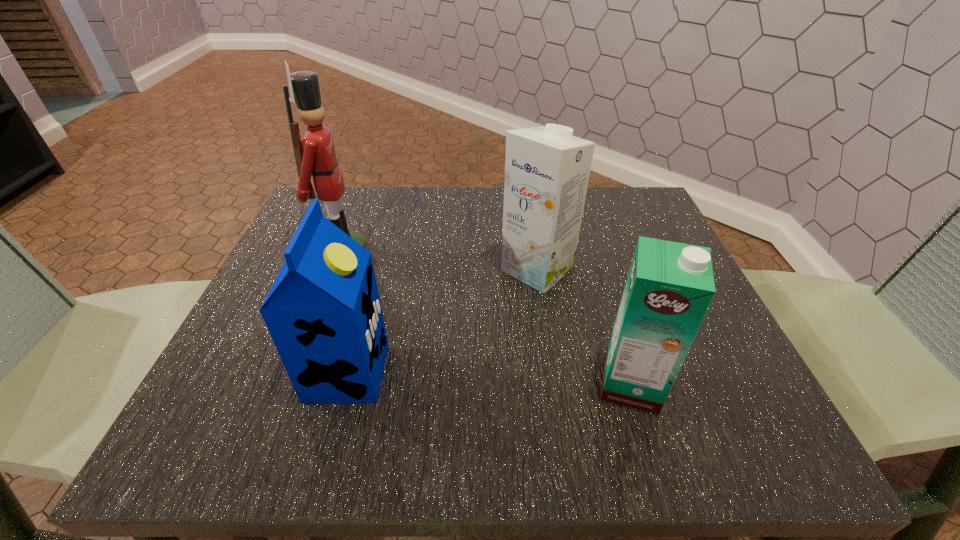
Identify the location of the tallest object. (315, 156).

Locate an element on the screen. This screenshot has width=960, height=540. the farthest carton is located at coordinates (547, 170).

Where is `the leftmost carton`? This screenshot has width=960, height=540. the leftmost carton is located at coordinates (323, 312).

You are a GUI agent. You are given a task and a screenshot of the screen. Output one action in this format:
    pyautogui.click(x=<x>, y=<y>)
    Task: Click on the blank space located on the front-facing side of the tallest object
    This screenshot has height=540, width=960.
    Given the screenshot: What is the action you would take?
    pyautogui.click(x=429, y=255)

Image resolution: width=960 pixels, height=540 pixels. Identify the location of blank space located on the front of the farthest carton. (555, 382).

At what (x,y) coordinates should I click in order to perform the action: click on vacant space located with the cap open on the leftmost carton. Please return your answer as a coordinate pair (x, y). Looking at the image, I should click on (541, 372).

Identify the location of object at the far edge. Image resolution: width=960 pixels, height=540 pixels. [315, 156].

The image size is (960, 540). I want to click on nutcracker located in the left edge section of the desktop, so click(x=315, y=156).

This screenshot has height=540, width=960. In order to click on carton located in the left edge section of the desktop in this screenshot , I will do `click(323, 312)`.

You are a GUI agent. You are given a task and a screenshot of the screen. Output one action in this format:
    pyautogui.click(x=<x>, y=<y>)
    Task: Click on the object present at the right edge
    The width and height of the screenshot is (960, 540).
    Given the screenshot: What is the action you would take?
    pyautogui.click(x=670, y=285)